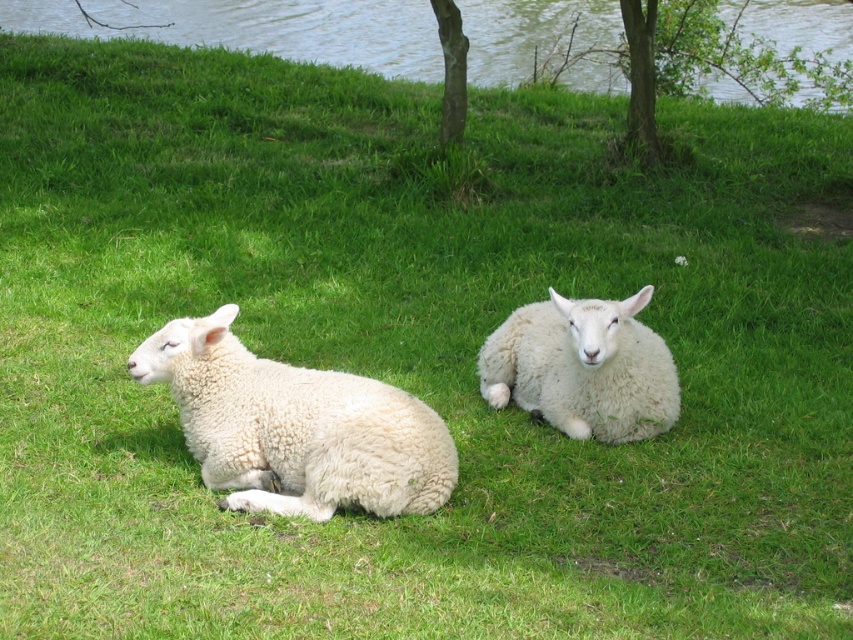
You are standing in the field where the two sheep are resting. You notice two points marked on the ground at coordinates point (633, 129) and point (457, 83). If you want to reach the point that is closer to you first, which coordinate should you walk towards?

You should walk towards point (457, 83) because it is closer to you than point (633, 129), which is further away.

You are standing at the origin point of the coordinate system in the image. You see two sheep, one at point (294, 428) and the other at an unknown location. Can you tell me which sheep is at the specified coordinate?

The white fluffy sheep at left is located at point (294, 428).